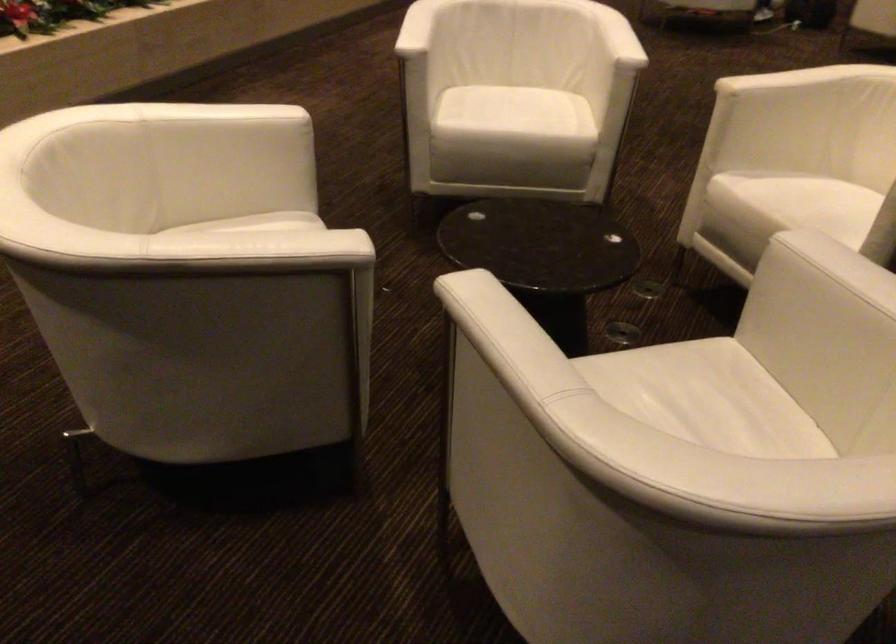
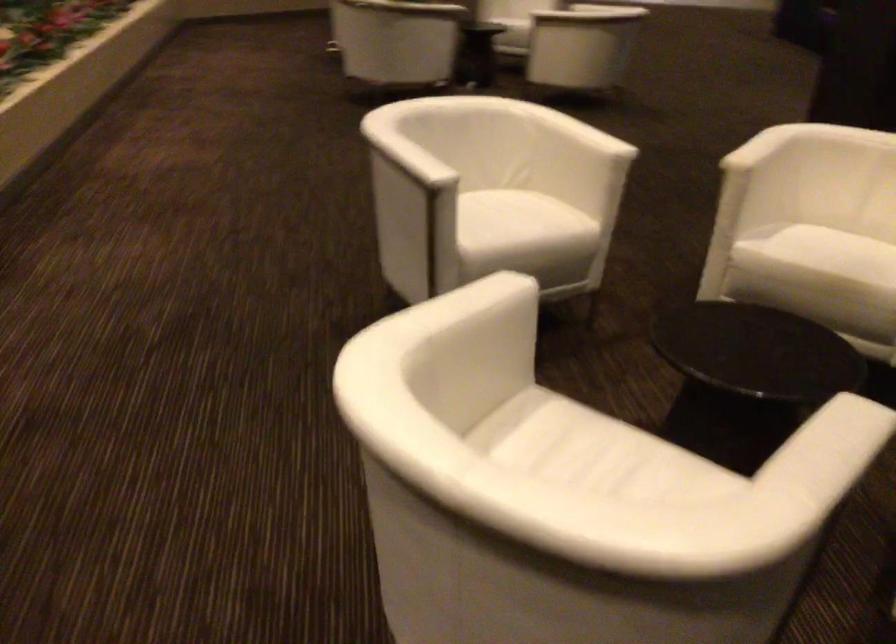
Find the pixel in the second image that matches (x=777, y=202) in the first image.

(836, 252)